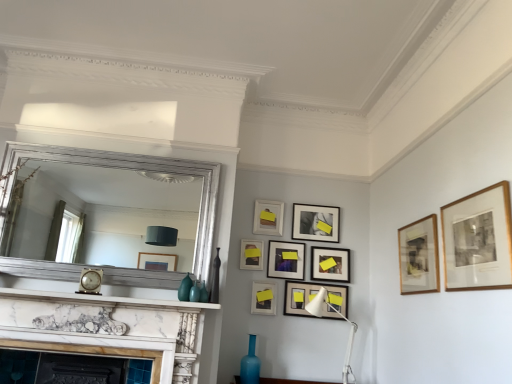
Find the location of `free spot above wooden framed artwork at upper right, positioned as the eighth picture frame in back-to-front order (from a real-world perspective)`. free spot above wooden framed artwork at upper right, positioned as the eighth picture frame in back-to-front order (from a real-world perspective) is located at coordinates tap(417, 219).